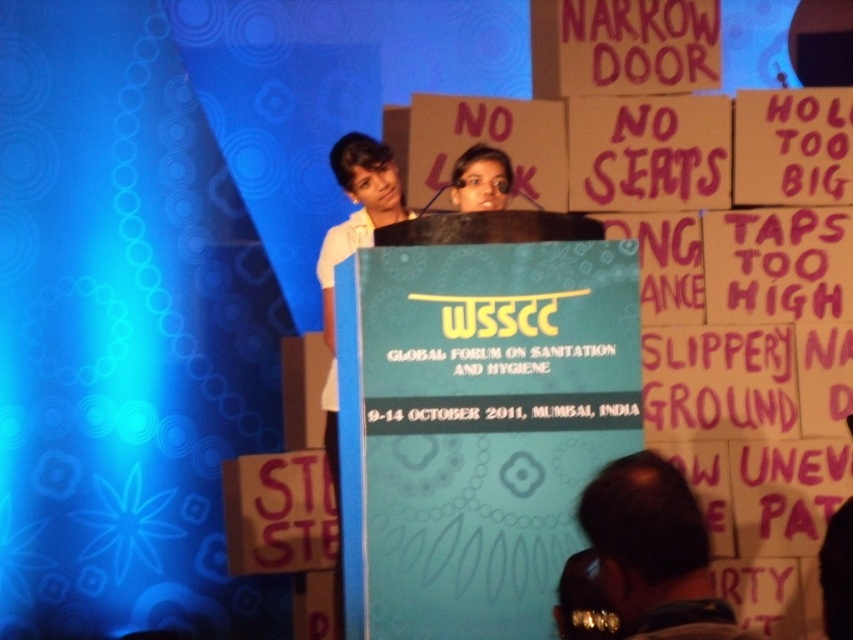
You are an event photographer at the WSSCC Global Forum on Sanitation and Hygiene in Mumbai. You need to capture a wide shot of the stage that includes both the dark brown leather jacket at lower right and the matte black hair at center. The camera you are using has a maximum width capacity of 1.2 meters. Can you fit both objects in the frame without moving the camera?

The dark brown leather jacket at lower right might be wider than matte black hair at center. Since the camera has a maximum width capacity of 1.2 meters, it is uncertain if both objects can fit within the frame without moving the camera. The photographer should check the actual width of the jacket to confirm.

You are standing at the stage of the WSSCC Global Forum on Sanitation and Hygiene in Mumbai. You see two points marked on the podium. Which point is closer to you? The points are labeled as point [630,593] and point [461,173].

Point [630,593] is closer to the viewer than point [461,173].